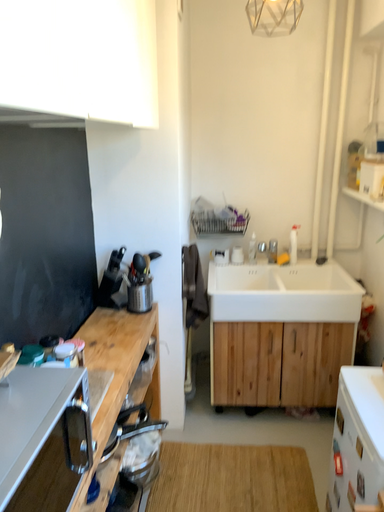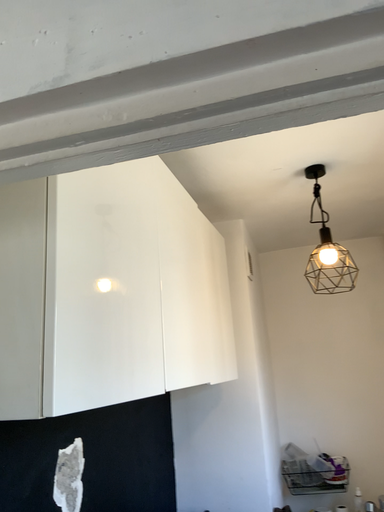
Question: How did the camera likely rotate when shooting the video?

Choices:
 (A) rotated right
 (B) rotated left

Answer: (B)